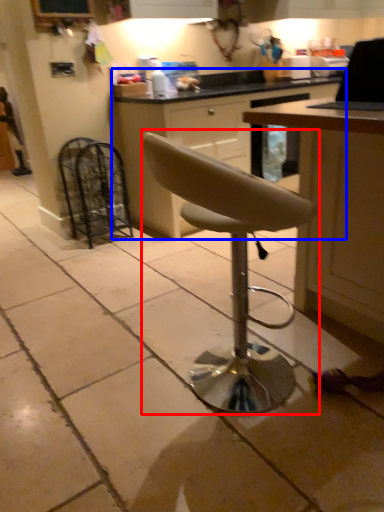
Question: Which of the following is the farthest to the observer, chair (highlighted by a red box) or cabinetry (highlighted by a blue box)?

Choices:
 (A) chair
 (B) cabinetry

Answer: (B)